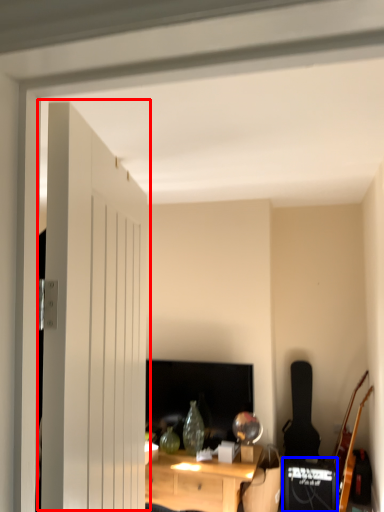
Question: Which point is further to the camera, door (highlighted by a red box) or speaker (highlighted by a blue box)?

Choices:
 (A) door
 (B) speaker

Answer: (B)